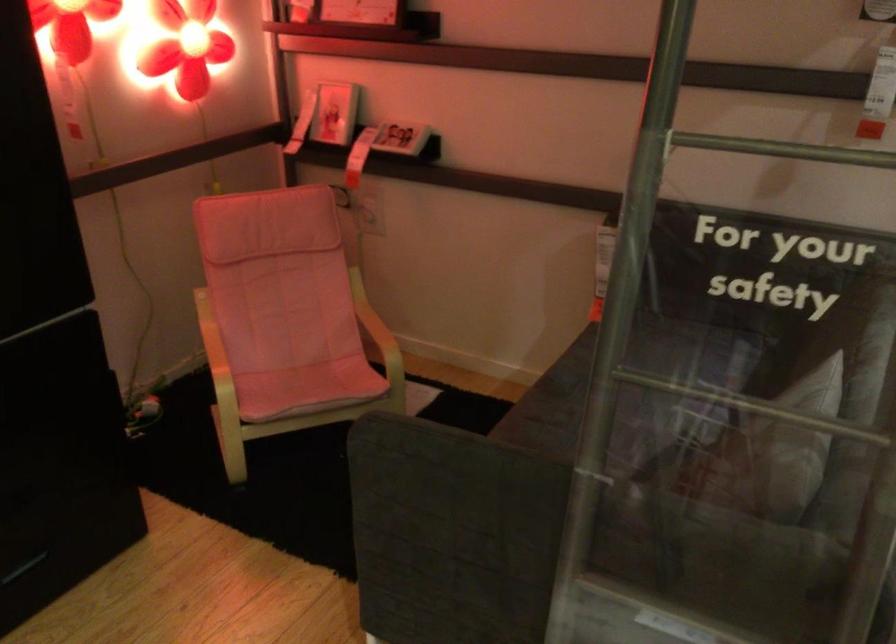
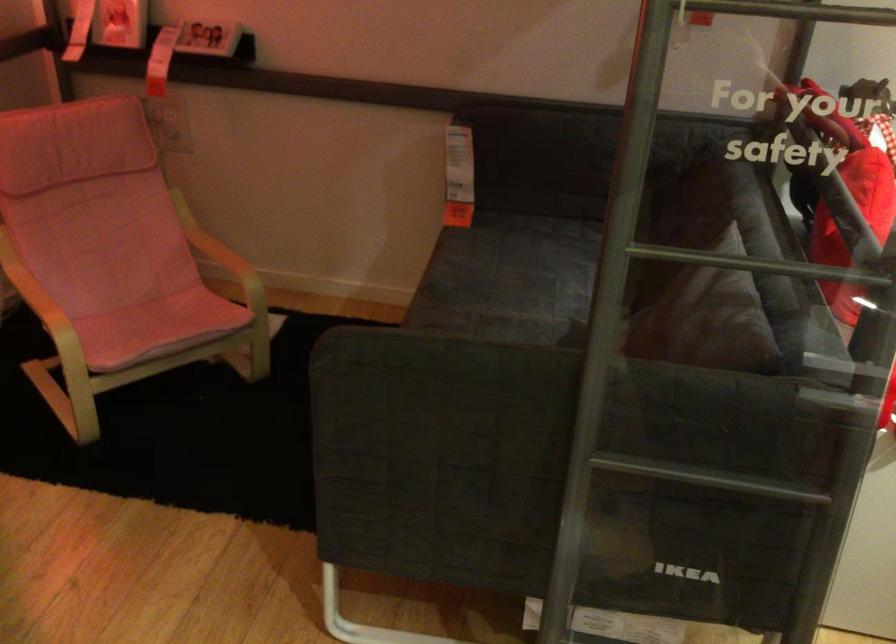
In the second image, find the point that corresponds to pixel 373 328 in the first image.

(220, 252)